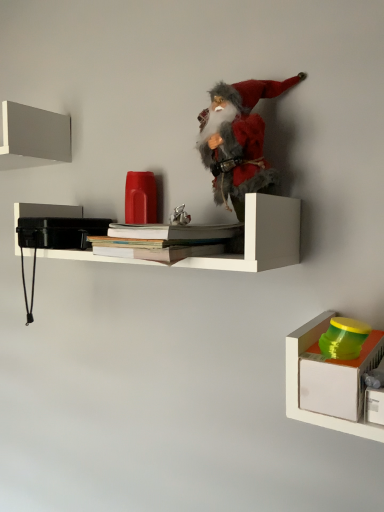
Question: Can you confirm if white matte shelf at center, arranged as the 2th shelf when viewed from the top, is taller than green plastic container at lower right, placed as the first toy when sorted from right to left?

Choices:
 (A) no
 (B) yes

Answer: (B)

Question: From the image's perspective, would you say white matte shelf at center, the 2th shelf positioned from the bottom, is shown under green plastic container at lower right, the 2th toy positioned from the back?

Choices:
 (A) yes
 (B) no

Answer: (B)

Question: Is white matte shelf at center, which is the 2th shelf from right to left, turned away from green plastic container at lower right, which is the 1th toy from bottom to top?

Choices:
 (A) no
 (B) yes

Answer: (A)

Question: Does white matte shelf at center, the 2th shelf positioned from the bottom, lie behind green plastic container at lower right, the first toy from the front?

Choices:
 (A) no
 (B) yes

Answer: (B)

Question: Is the position of white matte shelf at center, arranged as the 2th shelf when viewed from the top, less distant than that of green plastic container at lower right, which is the 1th toy from bottom to top?

Choices:
 (A) no
 (B) yes

Answer: (A)

Question: Is matte gray shelf at upper left, acting as the first shelf starting from the top, inside or outside of fuzzy fabric santa at center, the second toy when ordered from front to back?

Choices:
 (A) outside
 (B) inside

Answer: (A)

Question: From a real-world perspective, is matte gray shelf at upper left, the 3th shelf viewed from the right, above or below fuzzy fabric santa at center, the second toy from the bottom?

Choices:
 (A) above
 (B) below

Answer: (A)

Question: Would you say matte gray shelf at upper left, the 3th shelf viewed from the right, is to the left or to the right of fuzzy fabric santa at center, which ranks as the first toy in top-to-bottom order, in the picture?

Choices:
 (A) right
 (B) left

Answer: (B)

Question: From the image's perspective, is matte gray shelf at upper left, acting as the first shelf starting from the top, positioned above or below fuzzy fabric santa at center, which is the second toy in right-to-left order?

Choices:
 (A) below
 (B) above

Answer: (B)

Question: From the image's perspective, is white paper book at center, which appears as the second book when ordered from the bottom, positioned above or below green plastic container at lower right, placed as the first toy when sorted from right to left?

Choices:
 (A) below
 (B) above

Answer: (B)

Question: From their relative heights in the image, would you say white paper book at center, the 1th book in the top-to-bottom sequence, is taller or shorter than green plastic container at lower right, the first toy from the front?

Choices:
 (A) tall
 (B) short

Answer: (B)

Question: From a real-world perspective, is white paper book at center, the 1th book in the top-to-bottom sequence, physically located above or below green plastic container at lower right, the first toy from the front?

Choices:
 (A) below
 (B) above

Answer: (B)

Question: Do you think white paper book at center, the 1th book in the top-to-bottom sequence, is within green plastic container at lower right, placed as the first toy when sorted from right to left, or outside of it?

Choices:
 (A) inside
 (B) outside

Answer: (B)

Question: From a real-world perspective, relative to white paper book at center, the 1th book in the top-to-bottom sequence, is matte gray shelf at upper left, which is the third shelf in bottom-to-top order, vertically above or below?

Choices:
 (A) below
 (B) above

Answer: (B)

Question: From the image's perspective, is matte gray shelf at upper left, the first shelf positioned from the left, located above or below white paper book at center, which appears as the second book when ordered from the bottom?

Choices:
 (A) below
 (B) above

Answer: (B)